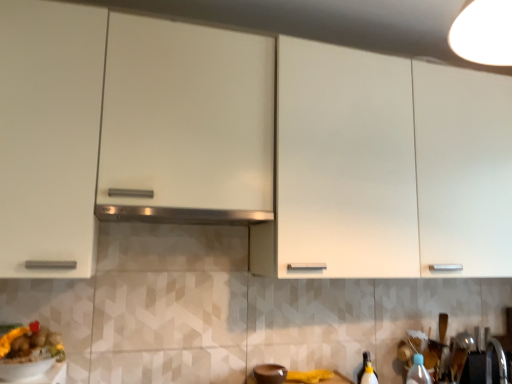
At what (x,y) coordinates should I click in order to perform the action: click on transparent plastic sink at lower right, placed as the 2th sink when sorted from right to left. Please return your answer as a coordinate pair (x, y). The image size is (512, 384). Looking at the image, I should click on (457, 356).

The image size is (512, 384). What do you see at coordinates (253, 149) in the screenshot?
I see `white glossy cabinet at upper center` at bounding box center [253, 149].

Image resolution: width=512 pixels, height=384 pixels. In order to click on yellow matte food at lower left in this screenshot , I will do `click(30, 344)`.

What is the approximate height of brown matte bowl at lower center?

brown matte bowl at lower center is 2.53 inches tall.

Locate an element on the screen. This screenshot has width=512, height=384. transparent plastic sink at lower right, which is the 2th sink in left-to-right order is located at coordinates (474, 368).

Where is `transparent plastic sink at lower right, placed as the 2th sink when sorted from right to left`? The width and height of the screenshot is (512, 384). transparent plastic sink at lower right, placed as the 2th sink when sorted from right to left is located at coordinates (457, 356).

Find the location of a particular element. The height and width of the screenshot is (384, 512). cabinetry that is in front of the transparent plastic sink at lower right, the first sink when ordered from left to right is located at coordinates (x=253, y=149).

From the image's perspective, is white glossy cabinet at upper center under transparent plastic sink at lower right, the first sink when ordered from left to right?

Actually, white glossy cabinet at upper center appears above transparent plastic sink at lower right, the first sink when ordered from left to right, in the image.

Is white glossy cabinet at upper center facing away from transparent plastic sink at lower right, the first sink when ordered from left to right?

white glossy cabinet at upper center does not have its back to transparent plastic sink at lower right, the first sink when ordered from left to right.

Considering the relative positions of white glossy cabinet at upper center and transparent plastic sink at lower right, the first sink when ordered from left to right, in the image provided, is white glossy cabinet at upper center behind transparent plastic sink at lower right, the first sink when ordered from left to right,?

No, white glossy cabinet at upper center is closer to the viewer.

Is satin silver exhaust hood at center to the left or to the right of yellow matte food at lower left in the image?

In the image, satin silver exhaust hood at center appears on the right side of yellow matte food at lower left.

Is satin silver exhaust hood at center smaller than yellow matte food at lower left?

No, satin silver exhaust hood at center is not smaller than yellow matte food at lower left.

Considering the positions of objects satin silver exhaust hood at center and yellow matte food at lower left in the image provided, who is in front, satin silver exhaust hood at center or yellow matte food at lower left?

yellow matte food at lower left is closer to the camera.

How far apart are satin silver exhaust hood at center and yellow matte food at lower left?

satin silver exhaust hood at center is 53.75 centimeters away from yellow matte food at lower left.

Based on their positions, is translucent plastic bottle at lower right located to the left or right of white glossy cabinet at upper center?

Clearly, translucent plastic bottle at lower right is on the right of white glossy cabinet at upper center in the image.

Between translucent plastic bottle at lower right and white glossy cabinet at upper center, which one has smaller size?

translucent plastic bottle at lower right.

From a real-world perspective, is translucent plastic bottle at lower right physically located above or below white glossy cabinet at upper center?

translucent plastic bottle at lower right is below white glossy cabinet at upper center.

Is yellow matte food at lower left next to transparent plastic sink at lower right, which is counted as the first sink, starting from the right, and touching it?

No.

Looking at this image, between yellow matte food at lower left and transparent plastic sink at lower right, which is the 2th sink in left-to-right order, which one has smaller size?

yellow matte food at lower left is smaller.

Between yellow matte food at lower left and transparent plastic sink at lower right, which is the 2th sink in left-to-right order, which one has less height?

yellow matte food at lower left.

Which object is positioned more to the right, yellow matte food at lower left or transparent plastic sink at lower right, which is the 2th sink in left-to-right order?

transparent plastic sink at lower right, which is the 2th sink in left-to-right order.

From the image's perspective, is yellow matte food at lower left under brown matte bowl at lower center?

No.

Which is more distant, (53, 333) or (261, 364)?

The point (261, 364) is behind.

Is yellow matte food at lower left oriented away from brown matte bowl at lower center?

No.

Considering the sizes of yellow matte food at lower left and satin silver exhaust hood at center in the image, is yellow matte food at lower left bigger or smaller than satin silver exhaust hood at center?

yellow matte food at lower left is smaller than satin silver exhaust hood at center.

Relative to satin silver exhaust hood at center, is yellow matte food at lower left in front or behind?

In the image, yellow matte food at lower left appears in front of satin silver exhaust hood at center.

Is yellow matte food at lower left positioned with its back to satin silver exhaust hood at center?

No, satin silver exhaust hood at center is not at the back of yellow matte food at lower left.

Does brown matte bowl at lower center have a smaller size compared to satin silver exhaust hood at center?

Yes, brown matte bowl at lower center is smaller than satin silver exhaust hood at center.

From a real-world perspective, which object rests below the other?

From a 3D spatial view, brown matte bowl at lower center is below.

From the image's perspective, does brown matte bowl at lower center appear lower than satin silver exhaust hood at center?

Yes, from the image's perspective, brown matte bowl at lower center is below satin silver exhaust hood at center.

Are brown matte bowl at lower center and satin silver exhaust hood at center beside each other?

No, brown matte bowl at lower center is not with satin silver exhaust hood at center.

Where is `the 1st sink located beneath the white glossy cabinet at upper center (from a real-world perspective)`? the 1st sink located beneath the white glossy cabinet at upper center (from a real-world perspective) is located at coordinates (457, 356).

I want to click on exhaust hood above the yellow matte food at lower left (from a real-world perspective), so click(x=180, y=215).

Considering their positions, is brown matte bowl at lower center positioned further to satin silver exhaust hood at center than transparent plastic sink at lower right, placed as the 2th sink when sorted from right to left?

transparent plastic sink at lower right, placed as the 2th sink when sorted from right to left, lies further to satin silver exhaust hood at center than the other object.

When comparing their distances from yellow matte food at lower left, does satin silver exhaust hood at center or translucent plastic bottle at lower right seem closer?

satin silver exhaust hood at center is closer to yellow matte food at lower left.

Based on their spatial positions, is transparent plastic sink at lower right, which is counted as the first sink, starting from the right, or translucent plastic bottle at lower right closer to satin silver exhaust hood at center?

Based on the image, translucent plastic bottle at lower right appears to be nearer to satin silver exhaust hood at center.

Considering their positions, is transparent plastic sink at lower right, placed as the 2th sink when sorted from right to left, positioned closer to brown matte bowl at lower center than yellow matte food at lower left?

yellow matte food at lower left is positioned closer to the anchor brown matte bowl at lower center.

Estimate the real-world distances between objects in this image. Which object is further from transparent plastic sink at lower right, which is the 2th sink in left-to-right order, transparent plastic sink at lower right, placed as the 2th sink when sorted from right to left, or white glossy cabinet at upper center?

Based on the image, white glossy cabinet at upper center appears to be further to transparent plastic sink at lower right, which is the 2th sink in left-to-right order.

When comparing their distances from white glossy cabinet at upper center, does transparent plastic sink at lower right, which is counted as the first sink, starting from the right, or satin silver exhaust hood at center seem further?

Based on the image, transparent plastic sink at lower right, which is counted as the first sink, starting from the right, appears to be further to white glossy cabinet at upper center.

Considering their positions, is yellow matte food at lower left positioned closer to brown matte bowl at lower center than satin silver exhaust hood at center?

satin silver exhaust hood at center is positioned closer to the anchor brown matte bowl at lower center.

Considering their positions, is transparent plastic sink at lower right, which is counted as the first sink, starting from the right, positioned further to yellow matte food at lower left than translucent plastic bottle at lower right?

transparent plastic sink at lower right, which is counted as the first sink, starting from the right, is positioned further to the anchor yellow matte food at lower left.

Find the location of `appliance between white glossy cabinet at upper center and translucent plastic bottle at lower right in the up-down direction`. appliance between white glossy cabinet at upper center and translucent plastic bottle at lower right in the up-down direction is located at coordinates (270, 373).

This screenshot has height=384, width=512. What are the coordinates of `bottle between yellow matte food at lower left and transparent plastic sink at lower right, which is the 2th sink in left-to-right order, in the horizontal direction` in the screenshot? It's located at (418, 371).

Where is `appliance situated between yellow matte food at lower left and white glossy cabinet at upper center from left to right`? Image resolution: width=512 pixels, height=384 pixels. appliance situated between yellow matte food at lower left and white glossy cabinet at upper center from left to right is located at coordinates (270, 373).

Where is `bottle situated between yellow matte food at lower left and transparent plastic sink at lower right, the first sink when ordered from left to right, from left to right`? bottle situated between yellow matte food at lower left and transparent plastic sink at lower right, the first sink when ordered from left to right, from left to right is located at coordinates (418, 371).